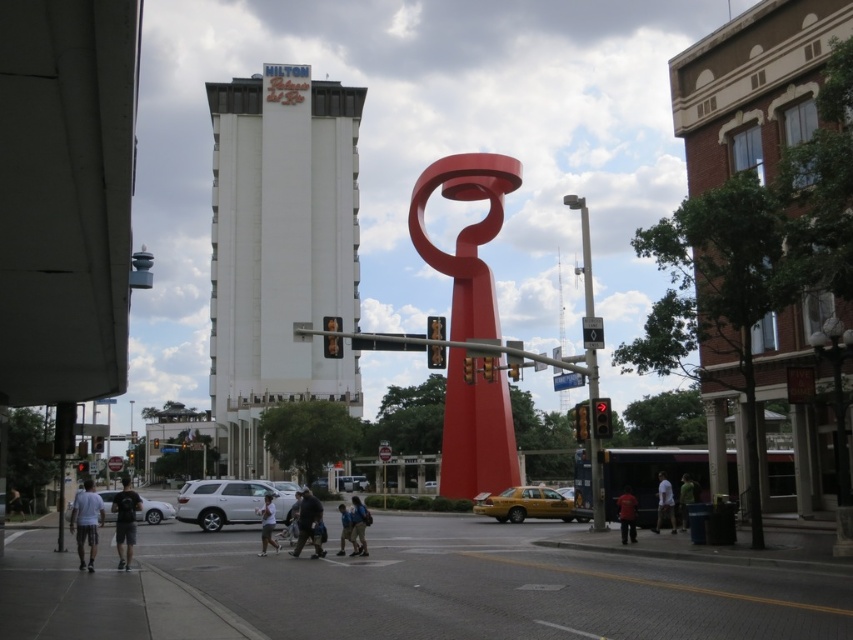
You are a tourist holding a map and trying to locate the Hilton Hotel. You see the white smooth building at upper center and the metallic pole at right. According to the map, the Hilton Hotel is to the left of the metallic pole. Which building should you look towards?

The white smooth building at upper center is positioned on the left side of the metallic pole at right, so you should look towards the white smooth building at upper center to find the Hilton Hotel.

You are a photographer standing at the intersection and want to capture both the white smooth building at upper center and the green fabric shirt at lower right in your shot. Which object should you focus on first if you want to ensure both are in sharp focus?

The white smooth building at upper center is taller than the green fabric shirt at lower right, so focusing on the white smooth building at upper center first would help ensure both are in sharp focus since it is the larger object in the frame.

You are a tourist standing at the intersection and want to take a photo of the white smooth building at upper center and the green fabric shirt at lower right. Which object should you point your camera towards first if you want to capture both in one shot?

The white smooth building at upper center is to the left of the green fabric shirt at lower right, so you should point your camera towards the white smooth building at upper center first to include both in the frame.